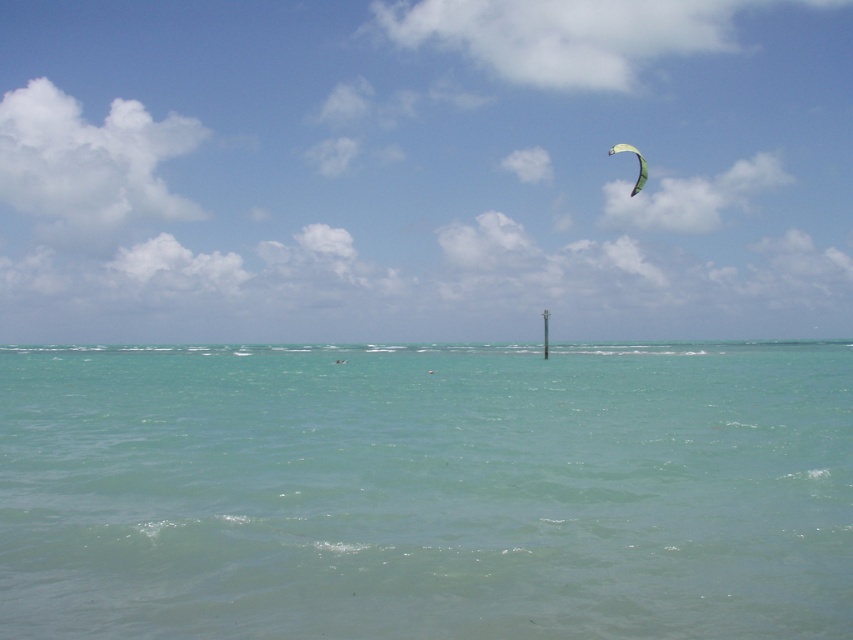
Question: Among these points, which one is nearest to the camera?

Choices:
 (A) (412, 323)
 (B) (685, 348)

Answer: (B)

Question: Does transparent kite at upper center have a smaller size compared to clear blue water at center?

Choices:
 (A) no
 (B) yes

Answer: (A)

Question: Can you confirm if transparent kite at upper center is positioned to the right of green fabric parachute at upper right?

Choices:
 (A) no
 (B) yes

Answer: (A)

Question: Is transparent kite at upper center closer to camera compared to green fabric parachute at upper right?

Choices:
 (A) no
 (B) yes

Answer: (B)

Question: Which of the following is the farthest from the observer?

Choices:
 (A) (618, 145)
 (B) (498, 17)
 (C) (733, 448)

Answer: (B)

Question: Which point appears farthest from the camera in this image?

Choices:
 (A) (633, 193)
 (B) (593, 332)
 (C) (456, 467)

Answer: (A)